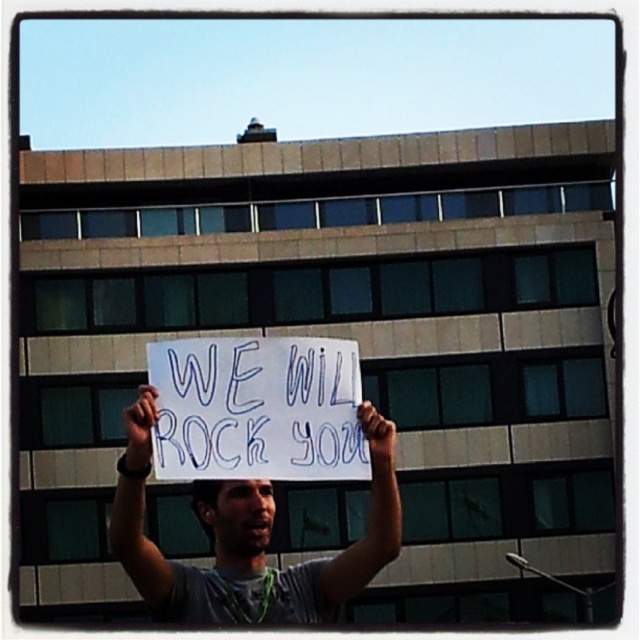
Is point (212, 349) closer to viewer compared to point (301, 612)?

Yes, it is in front of point (301, 612).

Can you confirm if white paper sign at center is taller than gray fabric shirt at center?

Incorrect, white paper sign at center's height is not larger of gray fabric shirt at center's.

Who is more forward, (161, 365) or (300, 614)?

Point (161, 365) is in front.

Locate an element on the screen. This screenshot has height=640, width=640. white paper sign at center is located at coordinates [257, 410].

Can you confirm if white paper sign at center is thinner than smooth skin hand at upper center?

Yes.

Between white paper sign at center and smooth skin hand at upper center, which one is positioned higher?

white paper sign at center

This screenshot has width=640, height=640. Identify the location of white paper sign at center. (257, 410).

Is smooth skin hand at center further to camera compared to smooth skin hand at upper center?

That is True.

Is point (372, 444) more distant than point (152, 424)?

Yes, point (372, 444) is behind point (152, 424).

Between point (394, 424) and point (140, 410), which one is positioned in front?

Point (140, 410) is in front.

At what (x,y) coordinates should I click in order to perform the action: click on smooth skin hand at center. Please return your answer as a coordinate pair (x, y). The image size is (640, 640). Looking at the image, I should click on (378, 435).